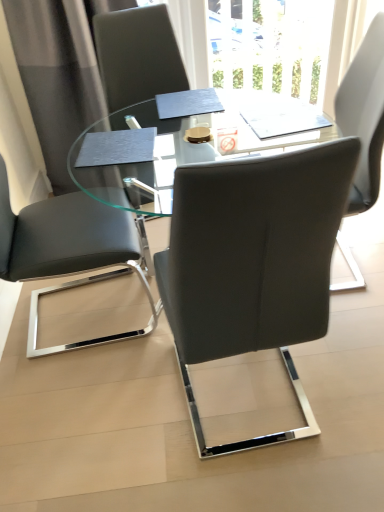
The width and height of the screenshot is (384, 512). What are the coordinates of `vacant area that lies between matte gray chair at center, which is the 1th chair from right to left, and transparent glass table at center` in the screenshot? It's located at (248, 397).